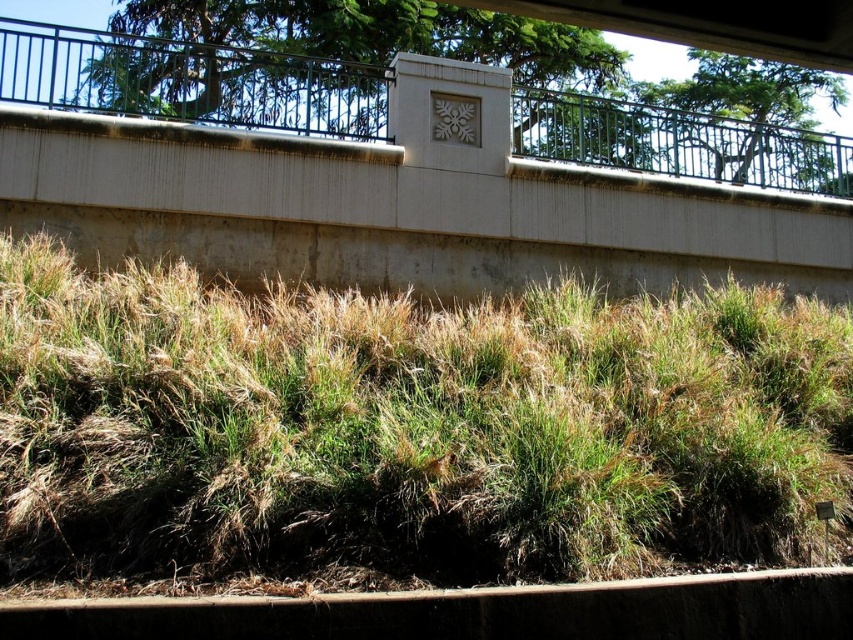
Is green grassy at center smaller than concrete at center?

No.

Who is more distant from viewer, [524,420] or [453,228]?

Point [453,228]

Does point (633, 497) come in front of point (200, 125)?

Yes, it is.

At what (x,y) coordinates should I click in order to perform the action: click on green grassy at center. Please return your answer as a coordinate pair (x, y). This screenshot has height=640, width=853. Looking at the image, I should click on (408, 428).